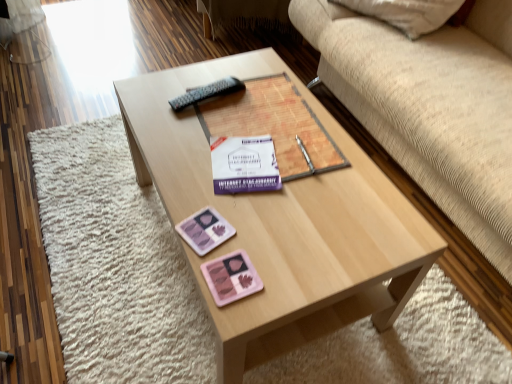
The image size is (512, 384). I want to click on vacant space to the right of pink matte eyeshadow palette at center, arranged as the 1th currency when viewed from the top, so click(277, 241).